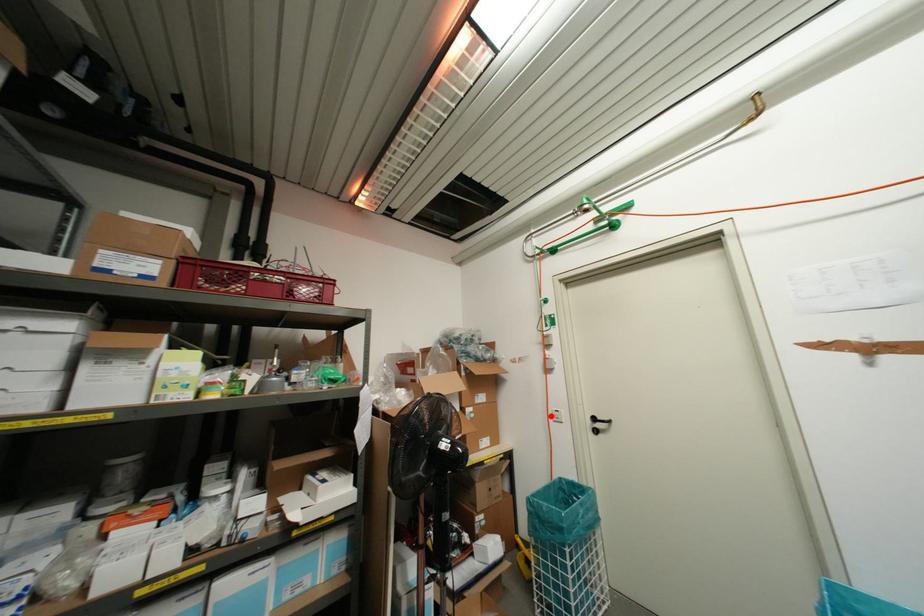
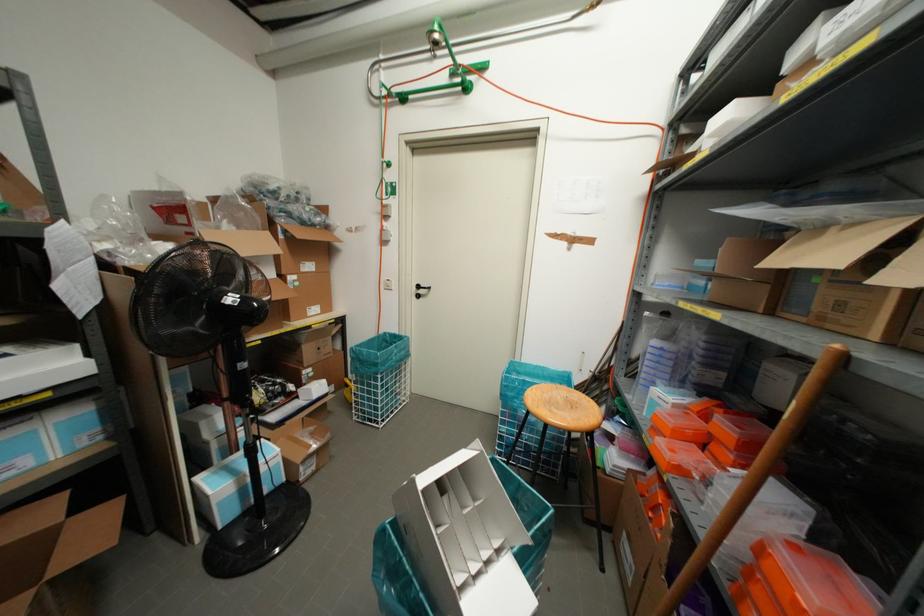
Question: I am providing you with two images of the same scene from different viewpoints. Image1 has a red point marked. In image2, the corresponding 3D location appears at what relative position? Reply with the corresponding letter.

Choices:
 (A) Closer
 (B) Farther

Answer: (A)